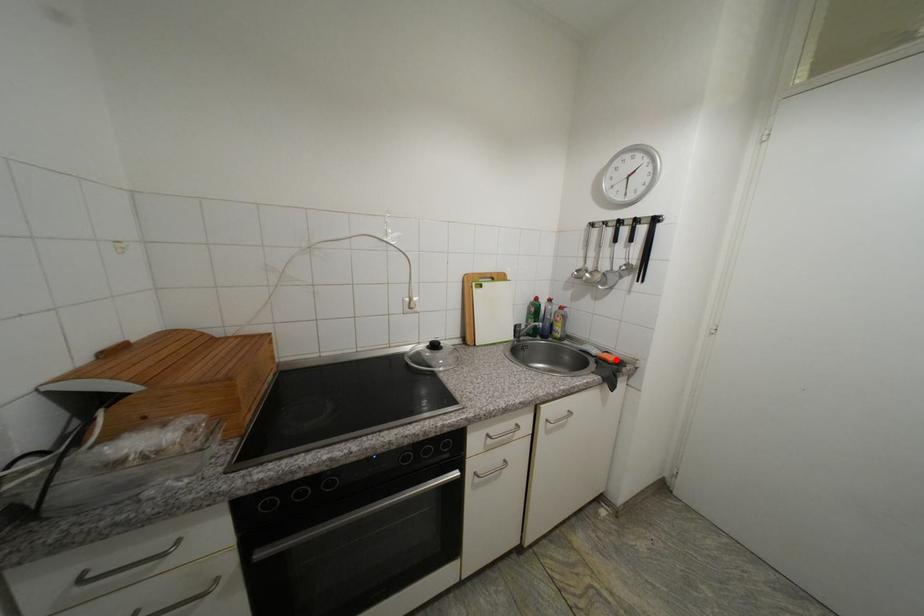
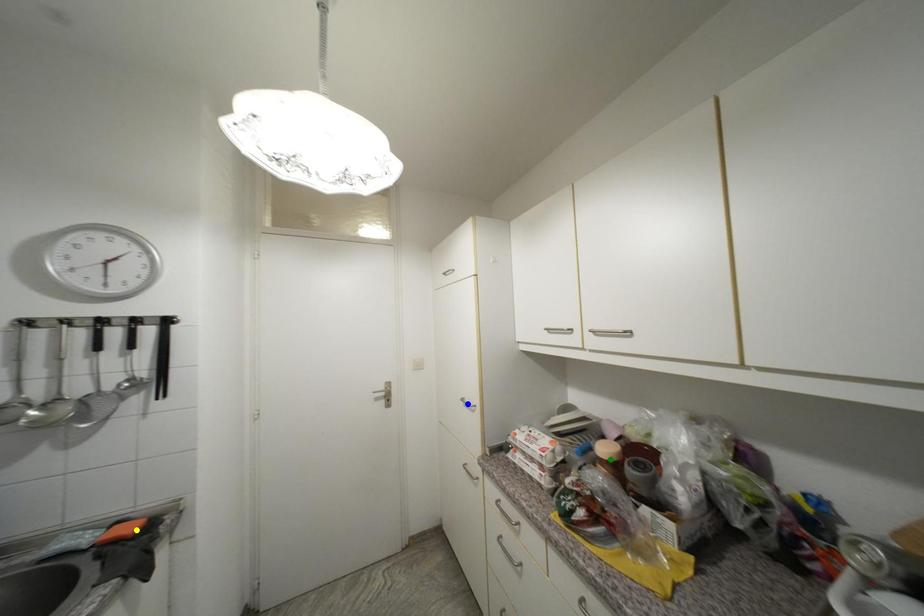
Question: I am providing you with two images of the same scene from different viewpoints. A red point is marked on the first image. You are given multiple points on the second image. Which spot in image 2 lines up with the point in image 1?

Choices:
 (A) yellow point
 (B) blue point
 (C) green point

Answer: (A)